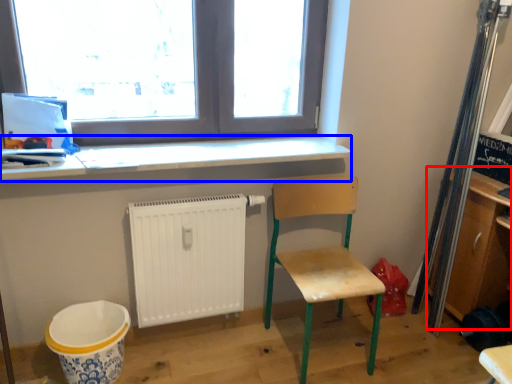
Question: Which of the following is the farthest to the observer, shelf (highlighted by a red box) or counter top (highlighted by a blue box)?

Choices:
 (A) shelf
 (B) counter top

Answer: (A)